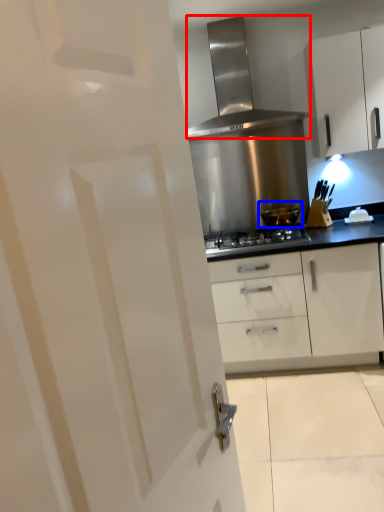
Question: Which object is closer to the camera taking this photo, home appliance (highlighted by a red box) or kitchen appliance (highlighted by a blue box)?

Choices:
 (A) home appliance
 (B) kitchen appliance

Answer: (A)